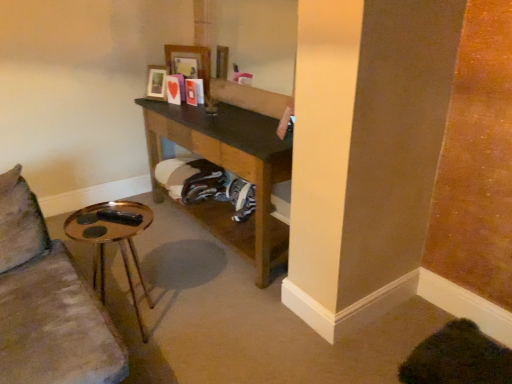
At what (x,y) coordinates should I click in order to perform the action: click on free space in front of brown wooden shelf at center. Please return your answer as a coordinate pair (x, y). This screenshot has width=512, height=384. Looking at the image, I should click on (225, 308).